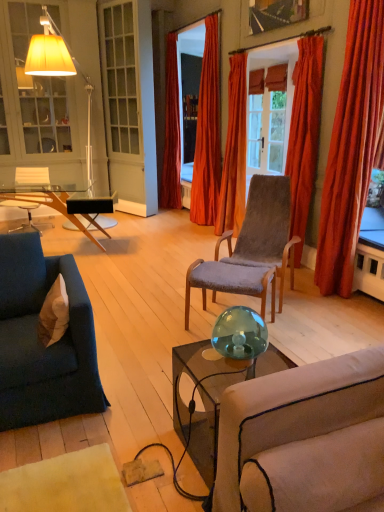
You are a GUI agent. You are given a task and a screenshot of the screen. Output one action in this format:
    pyautogui.click(x=<x>, y=<y>)
    Task: Click on the transparent glass chair at left, which is the 1th chair in back-to-front order
    
    Given the screenshot: What is the action you would take?
    coord(28,216)

Identify the location of orange velvet curtain at upper center, acting as the second curtain starting from the left. The height and width of the screenshot is (512, 384). (207, 134).

The image size is (384, 512). What do you see at coordinates (240, 333) in the screenshot?
I see `teal glass sphere at center` at bounding box center [240, 333].

Find the location of `transparent glass chair at left, which ranks as the second chair in front-to-back order`. transparent glass chair at left, which ranks as the second chair in front-to-back order is located at coordinates (28, 216).

Can you confirm if velvet blue couch at left is thinner than velvet orange curtain at center, which is the 1th curtain from left to right?

Incorrect, the width of velvet blue couch at left is not less than that of velvet orange curtain at center, which is the 1th curtain from left to right.

From a real-world perspective, is velvet blue couch at left physically located above or below velvet orange curtain at center, the fifth curtain viewed from the right?

From a real-world perspective, velvet blue couch at left is physically below velvet orange curtain at center, the fifth curtain viewed from the right.

From the image's perspective, is velvet blue couch at left located above velvet orange curtain at center, the fifth curtain viewed from the right?

Incorrect, from the image's perspective, velvet blue couch at left is lower than velvet orange curtain at center, the fifth curtain viewed from the right.

Is velvet orange curtain at center, which is the 1th curtain from left to right, inside velvet blue couch at left?

No, velvet orange curtain at center, which is the 1th curtain from left to right, is not surrounded by velvet blue couch at left.

Is white fabric pillow at lower left not close to matte glass cabinet at left?

white fabric pillow at lower left is positioned a significant distance from matte glass cabinet at left.

Does white fabric pillow at lower left have a larger size compared to matte glass cabinet at left?

Incorrect, white fabric pillow at lower left is not larger than matte glass cabinet at left.

Is white fabric pillow at lower left spatially inside matte glass cabinet at left, or outside of it?

white fabric pillow at lower left is located beyond the bounds of matte glass cabinet at left.

Considering the relative sizes of white fabric pillow at lower left and matte glass cabinet at left in the image provided, is white fabric pillow at lower left taller than matte glass cabinet at left?

Incorrect, the height of white fabric pillow at lower left is not larger of that of matte glass cabinet at left.

Which is in front, point (285, 209) or point (222, 228)?

Positioned in front is point (285, 209).

Can you confirm if velvet grey chair at center, arranged as the second chair when viewed from the left, is smaller than velvet orange curtain at center, which appears as the third curtain when viewed from the left?

No, velvet grey chair at center, arranged as the second chair when viewed from the left, is not smaller than velvet orange curtain at center, which appears as the third curtain when viewed from the left.

From the image's perspective, is velvet grey chair at center, acting as the second chair starting from the back, on velvet orange curtain at center, which appears as the third curtain when viewed from the left?

Incorrect, from the image's perspective, velvet grey chair at center, acting as the second chair starting from the back, is lower than velvet orange curtain at center, which appears as the third curtain when viewed from the left.

From a real-world perspective, between velvet grey chair at center, marked as the first chair in a right-to-left arrangement, and velvet orange curtain at center, arranged as the 3th curtain when viewed from the right, who is vertically lower?

velvet grey chair at center, marked as the first chair in a right-to-left arrangement, from a real-world perspective.

Is point (304, 71) closer to camera compared to point (259, 10)?

Yes.

From the picture: Does velvet orange curtain at upper right, the second curtain from the right, have a greater height compared to wooden picture frame at upper center?

Yes, velvet orange curtain at upper right, the second curtain from the right, is taller than wooden picture frame at upper center.

Is velvet orange curtain at upper right, the second curtain from the right, inside or outside of wooden picture frame at upper center?

velvet orange curtain at upper right, the second curtain from the right, lies outside wooden picture frame at upper center.

Is velvet orange curtain at upper right, which is counted as the fourth curtain, starting from the left, closer to the viewer compared to wooden picture frame at upper center?

Yes, it is in front of wooden picture frame at upper center.

Based on the photo, in the image, is clear glass door at center positioned in front of or behind velvet orange curtain at center, which is the 1th curtain from left to right?

In the image, clear glass door at center appears in front of velvet orange curtain at center, which is the 1th curtain from left to right.

Where is `window to the left of velvet orange curtain at center, the fifth curtain viewed from the right`? This screenshot has height=512, width=384. window to the left of velvet orange curtain at center, the fifth curtain viewed from the right is located at coordinates (120, 78).

Is clear glass door at center positioned with its back to velvet orange curtain at center, the fifth curtain viewed from the right?

Yes, clear glass door at center's orientation is away from velvet orange curtain at center, the fifth curtain viewed from the right.

Looking at the image, does transparent glass coffee table at left seem bigger or smaller compared to velvet orange curtain at center, the fifth curtain viewed from the right?

Considering their sizes, transparent glass coffee table at left takes up more space than velvet orange curtain at center, the fifth curtain viewed from the right.

From a real-world perspective, which object stands above the other?

In real-world perspective, velvet orange curtain at center, which is the 1th curtain from left to right, is above.

Is transparent glass coffee table at left aimed at velvet orange curtain at center, the fifth curtain viewed from the right?

No, transparent glass coffee table at left is not oriented towards velvet orange curtain at center, the fifth curtain viewed from the right.

You are a GUI agent. You are given a task and a screenshot of the screen. Output one action in this format:
    pyautogui.click(x=<x>, y=<y>)
    Task: Click on the coffee table directly beneath the velvet orange curtain at center, the fifth curtain viewed from the right (from a real-world perspective)
    The height and width of the screenshot is (512, 384).
    Given the screenshot: What is the action you would take?
    pyautogui.click(x=63, y=203)

Is point (289, 178) closer or farther from the camera than point (220, 338)?

Clearly, point (289, 178) is more distant from the camera than point (220, 338).

Is velvet grey chair at center, which is the first chair in front-to-back order, far away from teal glass sphere at center?

velvet grey chair at center, which is the first chair in front-to-back order, is far away from teal glass sphere at center.

Does velvet grey chair at center, which is the first chair in front-to-back order, have a smaller size compared to teal glass sphere at center?

No, velvet grey chair at center, which is the first chair in front-to-back order, is not smaller than teal glass sphere at center.

The image size is (384, 512). I want to click on studio couch in front of the velvet orange curtain at center, the fifth curtain viewed from the right, so click(39, 343).

Image resolution: width=384 pixels, height=512 pixels. Find the location of `pillow beneath the matte glass cabinet at left (from a real-world perspective)`. pillow beneath the matte glass cabinet at left (from a real-world perspective) is located at coordinates (54, 314).

Looking at the image, which one is located further to transparent glass coffee table at left, orange velvet curtain at upper center, which is counted as the 4th curtain, starting from the right, or velvet blue couch at left?

velvet blue couch at left is further to transparent glass coffee table at left.

Looking at this image, from the image, which object appears to be nearer to velvet blue couch at left, velvet grey chair at center, marked as the first chair in a right-to-left arrangement, or velvet orange curtain at center, arranged as the 3th curtain when viewed from the right?

The object closer to velvet blue couch at left is velvet grey chair at center, marked as the first chair in a right-to-left arrangement.

Looking at the image, which one is located closer to matte glass cabinet at left, velvet orange curtain at center, which appears as the third curtain when viewed from the left, or velvet orange curtain at center, the fifth curtain viewed from the right?

velvet orange curtain at center, the fifth curtain viewed from the right.

Based on their spatial positions, is velvet blue couch at left or velvet grey chair at center, which is the first chair in front-to-back order, closer to velvet orange curtain at center, arranged as the 3th curtain when viewed from the right?

The object closer to velvet orange curtain at center, arranged as the 3th curtain when viewed from the right, is velvet grey chair at center, which is the first chair in front-to-back order.

Estimate the real-world distances between objects in this image. Which object is closer to velvet orange curtain at center, which is the 1th curtain from left to right, velvet orange curtain at center, arranged as the 3th curtain when viewed from the right, or clear glass door at center?

Based on the image, clear glass door at center appears to be nearer to velvet orange curtain at center, which is the 1th curtain from left to right.

Estimate the real-world distances between objects in this image. Which object is closer to velvet blue couch at left, teal glass sphere at center or transparent glass coffee table at left?

teal glass sphere at center.

Which object lies further to the anchor point velvet orange curtain at center, arranged as the 3th curtain when viewed from the right, matte glass window screen at upper right or transparent glass coffee table at left?

transparent glass coffee table at left is positioned further to the anchor velvet orange curtain at center, arranged as the 3th curtain when viewed from the right.

Estimate the real-world distances between objects in this image. Which object is further from velvet orange curtain at center, which appears as the third curtain when viewed from the left, orange velvet curtain at upper center, acting as the second curtain starting from the left, or white fabric pillow at lower left?

white fabric pillow at lower left is positioned further to the anchor velvet orange curtain at center, which appears as the third curtain when viewed from the left.

You are a GUI agent. You are given a task and a screenshot of the screen. Output one action in this format:
    pyautogui.click(x=<x>, y=<y>)
    Task: Click on the teal between velvet blue couch at left and velvet grey chair at center, acting as the second chair starting from the back, in the horizontal direction
    The height and width of the screenshot is (512, 384).
    Given the screenshot: What is the action you would take?
    pyautogui.click(x=240, y=333)

Locate an element on the screen. The width and height of the screenshot is (384, 512). chair positioned between teal glass sphere at center and transparent glass chair at left, the first chair viewed from the left, from near to far is located at coordinates (253, 248).

Locate an element on the screen. This screenshot has height=512, width=384. coffee table between velvet blue couch at left and orange velvet curtain at upper center, which is counted as the 4th curtain, starting from the right, in the front-back direction is located at coordinates (63, 203).

You are a GUI agent. You are given a task and a screenshot of the screen. Output one action in this format:
    pyautogui.click(x=<x>, y=<y>)
    Task: Click on the window screen between white fabric pillow at lower left and transparent glass chair at left, the first chair viewed from the left, in the front-back direction
    The width and height of the screenshot is (384, 512).
    Given the screenshot: What is the action you would take?
    (x=267, y=120)